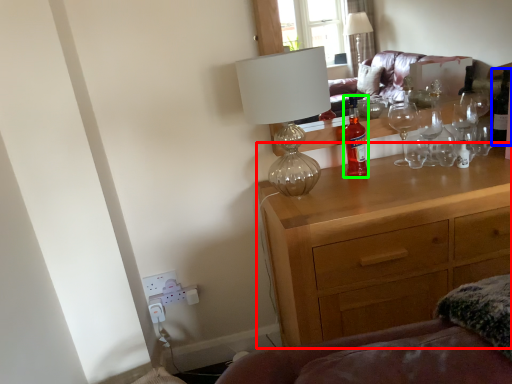
Question: Based on their relative distances, which object is nearer to chest of drawers (highlighted by a red box)? Choose from wine bottle (highlighted by a blue box) and bottle (highlighted by a green box).

Choices:
 (A) wine bottle
 (B) bottle

Answer: (B)